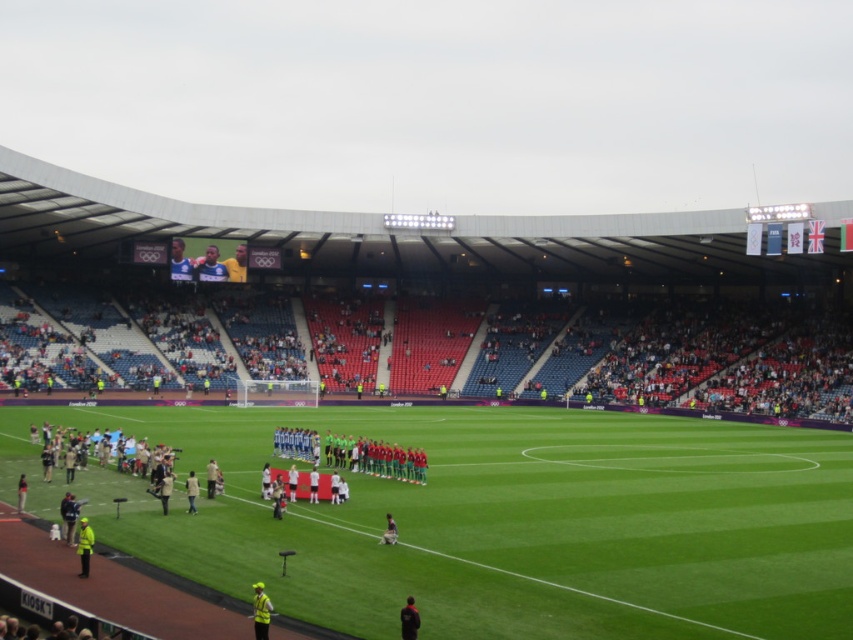
Does black fabric jacket at lower center have a smaller size compared to green jersey at center?

Correct, black fabric jacket at lower center occupies less space than green jersey at center.

Is point (402, 634) behind point (395, 525)?

No, (402, 634) is closer to viewer.

Identify the location of black fabric jacket at lower center. The image size is (853, 640). (409, 620).

Is point (78, 547) in front of point (383, 531)?

Yes, it is.

Who is more forward, (86, 528) or (396, 529)?

Positioned in front is point (86, 528).

The image size is (853, 640). What do you see at coordinates (84, 545) in the screenshot?
I see `high visibility jacket at lower left` at bounding box center [84, 545].

The width and height of the screenshot is (853, 640). I want to click on high visibility jacket at lower left, so click(x=84, y=545).

Between white glossy uniform at center and smooth blue shirt at upper center, which one has more height?

smooth blue shirt at upper center

Consider the image. Measure the distance between point [346,448] and camera.

42.11 meters

The height and width of the screenshot is (640, 853). I want to click on white glossy uniform at center, so click(x=352, y=452).